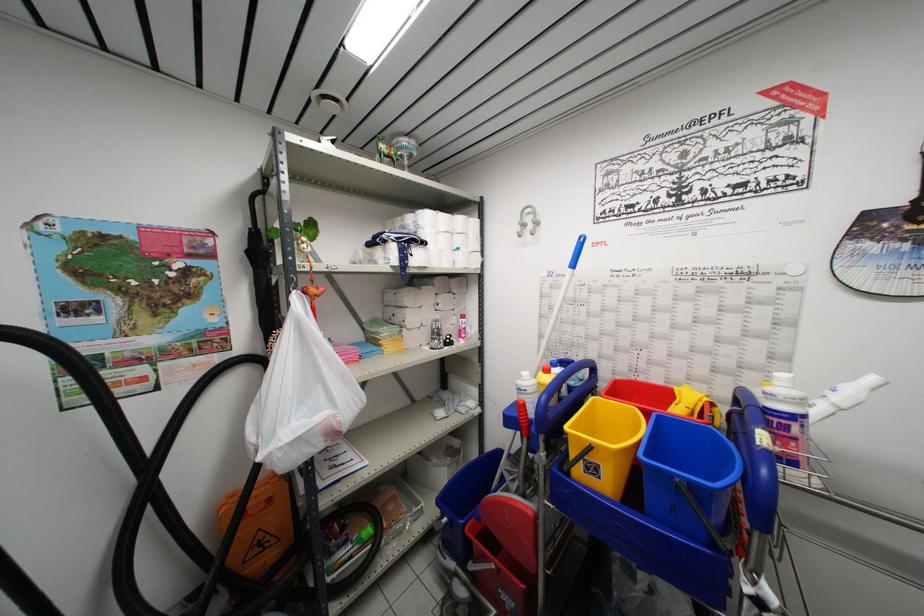
Where is `red mop press handle`? The image size is (924, 616). red mop press handle is located at coordinates (535, 430).